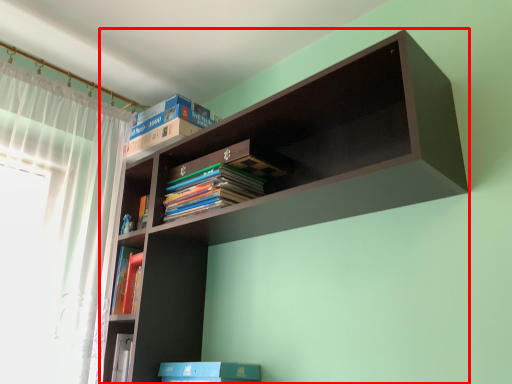
Question: From the image's perspective, considering the relative positions of shelf (annotated by the red box) and book in the image provided, where is shelf (annotated by the red box) located with respect to the staircase?

Choices:
 (A) below
 (B) above

Answer: (A)